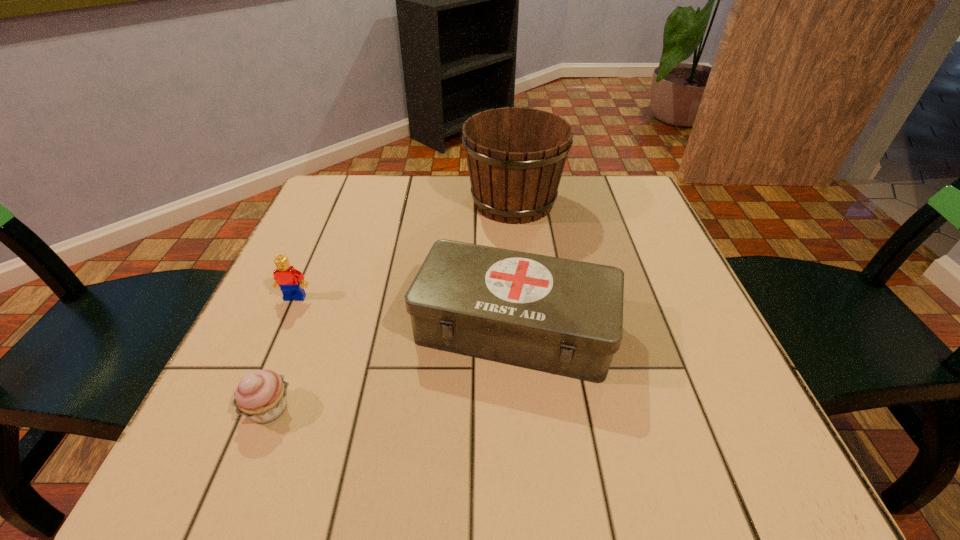
Image resolution: width=960 pixels, height=540 pixels. What are the coordinates of `wine bucket` in the screenshot? It's located at (516, 156).

Find the location of `the farthest object`. the farthest object is located at coordinates (516, 156).

You are a GUI agent. You are given a task and a screenshot of the screen. Output one action in this format:
    pyautogui.click(x=<x>, y=<y>)
    Task: Click on the first-aid kit
    The image size is (960, 540).
    Given the screenshot: What is the action you would take?
    pyautogui.click(x=565, y=317)

At what (x,y) coordinates should I click in order to perform the action: click on Lego. Please return your answer as a coordinate pair (x, y). Looking at the image, I should click on (287, 278).

Find the location of a particular element. This screenshot has height=540, width=960. the nearest object is located at coordinates (261, 396).

The height and width of the screenshot is (540, 960). In order to click on cupcake in this screenshot , I will do `click(261, 396)`.

Locate an element on the screen. The image size is (960, 540). vacant area located 0.170m on the front of the farthest object is located at coordinates (521, 280).

The image size is (960, 540). In order to click on free region located 0.100m on the back of the first-aid kit in this screenshot , I will do `click(509, 251)`.

This screenshot has height=540, width=960. I want to click on vacant space located 0.060m on the front-facing side of the Lego, so click(x=283, y=325).

Locate an element on the screen. The image size is (960, 540). vacant region located on the right of the shortest object is located at coordinates (482, 408).